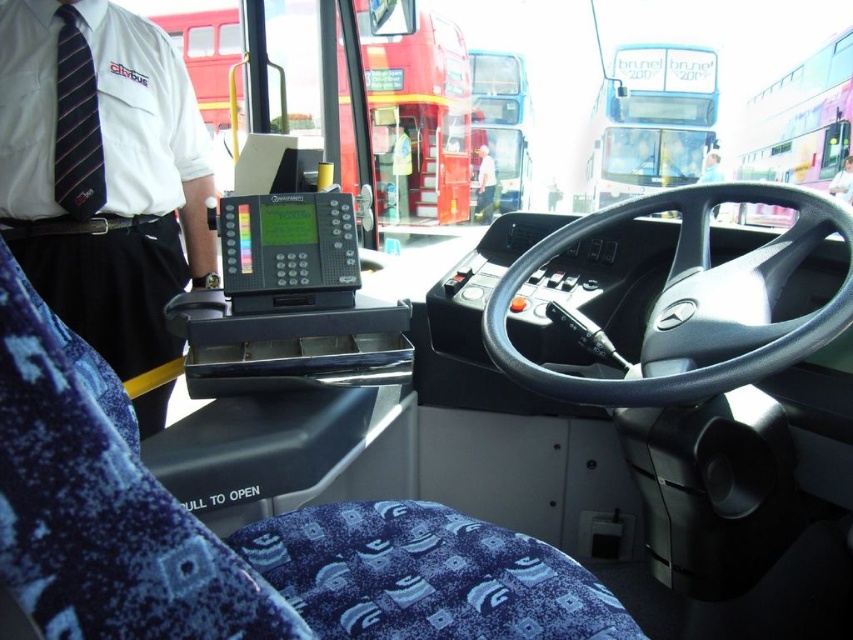
You are a passenger on the bus and want to ask the driver a question. Which object, the white shirt with tie at upper left or the black leather steering wheel at center, is closer to you if you are sitting in the front passenger seat?

The white shirt with tie at upper left is closer to you because it is thinner than the black leather steering wheel at center, meaning it occupies less space in the vertical dimension and is positioned nearer to your line of sight from the front passenger seat.

You are a passenger sitting in the front seat of the bus. You want to ask the driver a question but need to get their attention. You notice the black leather steering wheel at center and the white fabric shirt at center. Which object is closer to the driver so you can tap it to get their attention?

The black leather steering wheel at center is to the left of the white fabric shirt at center, so it is closer to the driver. You should tap the black leather steering wheel at center to get their attention.